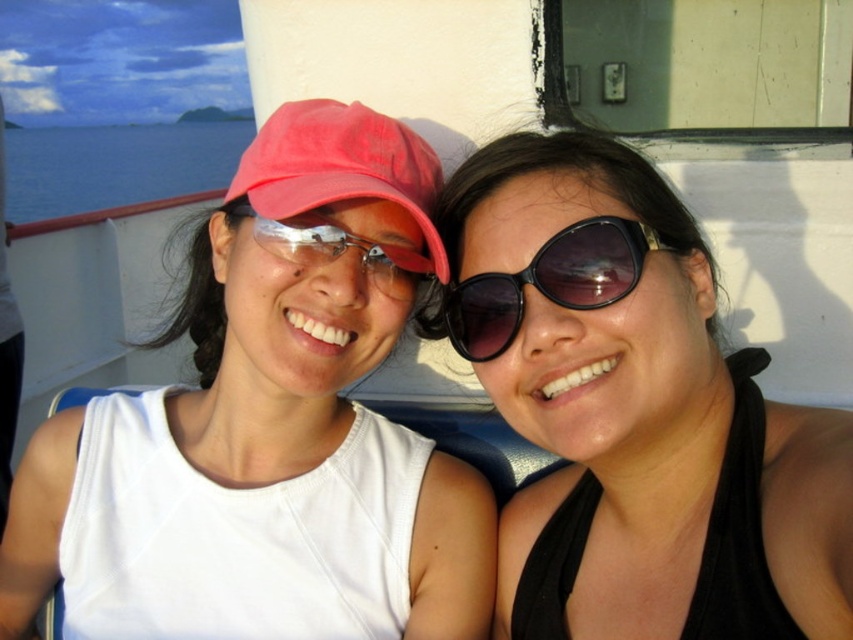
Based on the coordinates provided, which object is located at point [115,164]?

The point [115,164] indicates blue water at left.

You are a photographer trying to focus on both points in the image. Which point is closer to the camera, point (225, 124) or point (610, 260)?

Point (225, 124) is closer to the camera than point (610, 260).